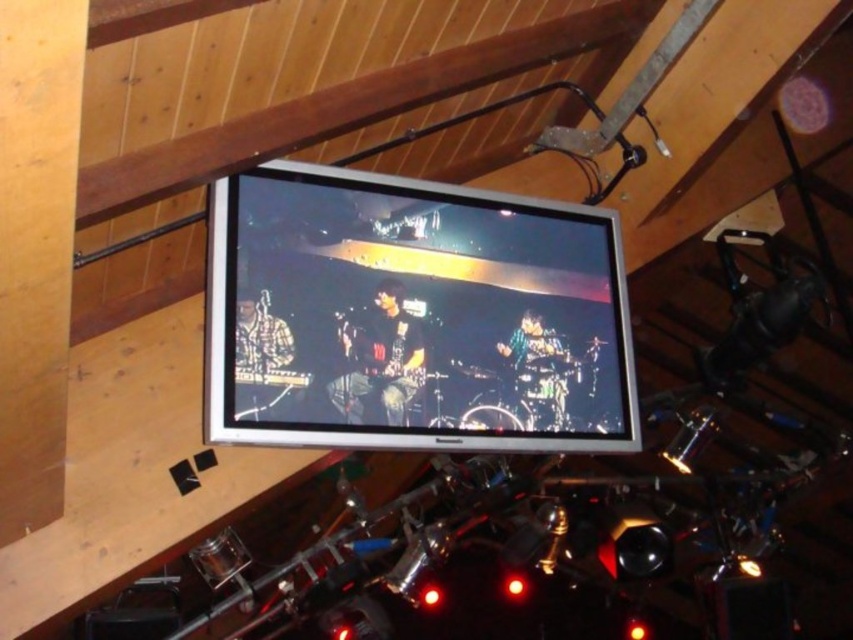
Question: Is matte silver tv at upper center wider than shiny black guitar at center?

Choices:
 (A) yes
 (B) no

Answer: (A)

Question: Estimate the real-world distances between objects in this image. Which object is farther from the matte silver tv at upper center?

Choices:
 (A) shiny black guitar at center
 (B) shiny metallic drum set at center

Answer: (B)

Question: Based on their relative distances, which object is nearer to the shiny black guitar at center?

Choices:
 (A) shiny metallic drum set at center
 (B) matte silver tv at upper center

Answer: (B)

Question: Among these objects, which one is nearest to the camera?

Choices:
 (A) shiny black guitar at center
 (B) shiny metallic drum set at center

Answer: (A)

Question: Can you confirm if matte silver tv at upper center is positioned to the left of shiny metallic drum set at center?

Choices:
 (A) yes
 (B) no

Answer: (A)

Question: Can you confirm if matte silver tv at upper center is positioned below shiny metallic drum set at center?

Choices:
 (A) no
 (B) yes

Answer: (A)